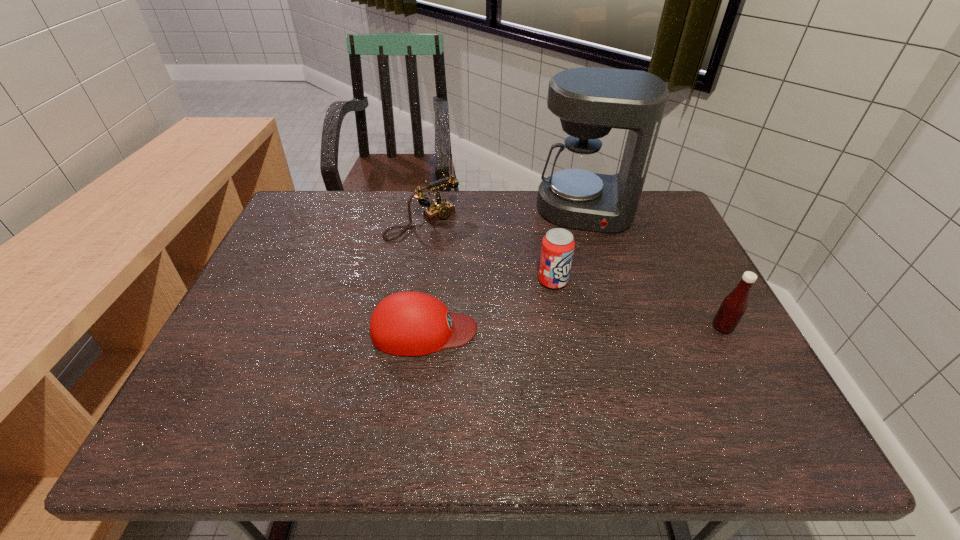
Locate an element on the screen. free space between the Tabasco sauce and the telephone is located at coordinates (572, 275).

The image size is (960, 540). Identify the location of vacant point located between the telephone and the baseball cap. (423, 276).

The width and height of the screenshot is (960, 540). Identify the location of empty space between the soda can and the shortest object. (489, 306).

At what (x,y) coordinates should I click in order to perform the action: click on vacant space in between the telephone and the soda can. Please return your answer as a coordinate pair (x, y). Looking at the image, I should click on click(488, 252).

The height and width of the screenshot is (540, 960). Identify the location of free space between the tallest object and the Tabasco sauce. (654, 269).

At what (x,y) coordinates should I click in order to perform the action: click on free space that is in between the Tabasco sauce and the baseball cap. Please return your answer as a coordinate pair (x, y). Looking at the image, I should click on (573, 329).

The image size is (960, 540). I want to click on vacant point located between the shortest object and the soda can, so click(x=489, y=306).

What are the coordinates of `object that is the third nearest to the rightmost object` in the screenshot? It's located at (x=408, y=323).

Identify the location of object that is the third closest one to the soda can. (439, 209).

This screenshot has height=540, width=960. Find the location of `vacant space that satisfies the following two spatial constraints: 1. on the front side of the telephone; 2. on the left side of the rightmost object`. vacant space that satisfies the following two spatial constraints: 1. on the front side of the telephone; 2. on the left side of the rightmost object is located at coordinates (406, 327).